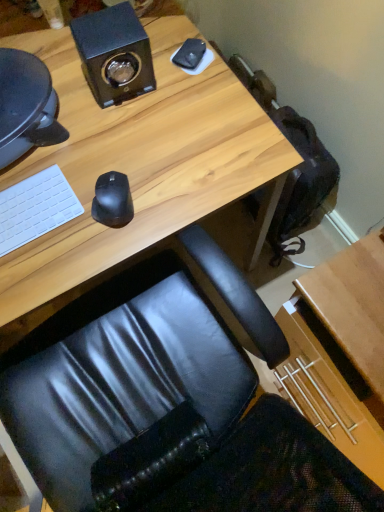
Question: From the image's perspective, is wooden desk at center over black matte speaker at upper left?

Choices:
 (A) no
 (B) yes

Answer: (A)

Question: Is wooden desk at center wider than black matte speaker at upper left?

Choices:
 (A) yes
 (B) no

Answer: (A)

Question: Does wooden desk at center appear on the left side of black matte speaker at upper left?

Choices:
 (A) yes
 (B) no

Answer: (A)

Question: Is wooden desk at center bigger than black matte speaker at upper left?

Choices:
 (A) yes
 (B) no

Answer: (A)

Question: Is wooden desk at center aimed at black matte speaker at upper left?

Choices:
 (A) yes
 (B) no

Answer: (B)

Question: Based on their positions, is wooden desk at center located to the left or right of black matte mouse at center?

Choices:
 (A) left
 (B) right

Answer: (A)

Question: Is wooden desk at center taller or shorter than black matte mouse at center?

Choices:
 (A) tall
 (B) short

Answer: (A)

Question: From a real-world perspective, relative to black matte mouse at center, is wooden desk at center vertically above or below?

Choices:
 (A) below
 (B) above

Answer: (A)

Question: Considering the positions of wooden desk at center and black matte mouse at center in the image, is wooden desk at center wider or thinner than black matte mouse at center?

Choices:
 (A) wide
 (B) thin

Answer: (A)

Question: From a real-world perspective, is wooden desk at center above or below black matte speaker at upper left?

Choices:
 (A) above
 (B) below

Answer: (B)

Question: Is point [226, 130] closer or farther from the camera than point [122, 36]?

Choices:
 (A) closer
 (B) farther

Answer: (B)

Question: Considering their positions, is wooden desk at center located in front of or behind black matte speaker at upper left?

Choices:
 (A) front
 (B) behind

Answer: (A)

Question: From the image's perspective, relative to black matte speaker at upper left, is wooden desk at center above or below?

Choices:
 (A) below
 (B) above

Answer: (A)

Question: Does point (96, 181) appear closer or farther from the camera than point (44, 186)?

Choices:
 (A) farther
 (B) closer

Answer: (A)

Question: Considering their positions, is black matte mouse at center located in front of or behind white matte keyboard at left?

Choices:
 (A) behind
 (B) front

Answer: (A)